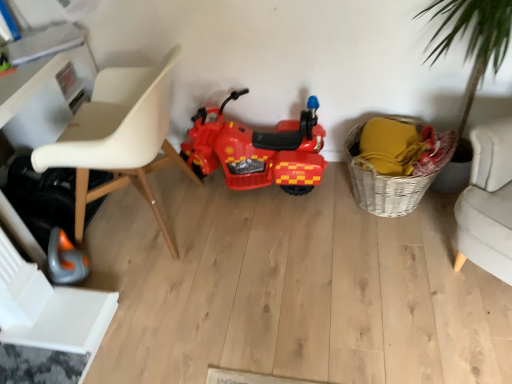
Question: Is shiny plastic motorcycle at center smaller than white plastic swivel chair at lower left?

Choices:
 (A) yes
 (B) no

Answer: (B)

Question: Can you confirm if shiny plastic motorcycle at center is wider than white plastic swivel chair at lower left?

Choices:
 (A) yes
 (B) no

Answer: (B)

Question: Is shiny plastic motorcycle at center thinner than white plastic swivel chair at lower left?

Choices:
 (A) yes
 (B) no

Answer: (A)

Question: From a real-world perspective, is shiny plastic motorcycle at center located higher than white plastic swivel chair at lower left?

Choices:
 (A) no
 (B) yes

Answer: (B)

Question: Does shiny plastic motorcycle at center lie in front of white plastic swivel chair at lower left?

Choices:
 (A) no
 (B) yes

Answer: (A)

Question: In terms of height, does white plastic chair at left look taller or shorter compared to shiny plastic motorcycle at center?

Choices:
 (A) tall
 (B) short

Answer: (A)

Question: Looking at the image, does white plastic chair at left seem bigger or smaller compared to shiny plastic motorcycle at center?

Choices:
 (A) small
 (B) big

Answer: (B)

Question: In the image, is white plastic chair at left positioned in front of or behind shiny plastic motorcycle at center?

Choices:
 (A) behind
 (B) front

Answer: (B)

Question: From a real-world perspective, relative to shiny plastic motorcycle at center, is white plastic chair at left vertically above or below?

Choices:
 (A) above
 (B) below

Answer: (A)

Question: From the image's perspective, is shiny plastic motorcycle at center positioned above or below white plastic chair at left?

Choices:
 (A) below
 (B) above

Answer: (B)

Question: Considering the relative positions of shiny plastic motorcycle at center and white plastic chair at left in the image provided, is shiny plastic motorcycle at center to the left or to the right of white plastic chair at left?

Choices:
 (A) right
 (B) left

Answer: (A)

Question: In the image, is shiny plastic motorcycle at center positioned in front of or behind white plastic chair at left?

Choices:
 (A) behind
 (B) front

Answer: (A)

Question: Considering the positions of shiny plastic motorcycle at center and white plastic chair at left in the image, is shiny plastic motorcycle at center bigger or smaller than white plastic chair at left?

Choices:
 (A) big
 (B) small

Answer: (B)

Question: From the image's perspective, is shiny plastic motorcycle at center above or below woven basket at lower right?

Choices:
 (A) above
 (B) below

Answer: (A)

Question: In the image, is shiny plastic motorcycle at center on the left side or the right side of woven basket at lower right?

Choices:
 (A) left
 (B) right

Answer: (A)